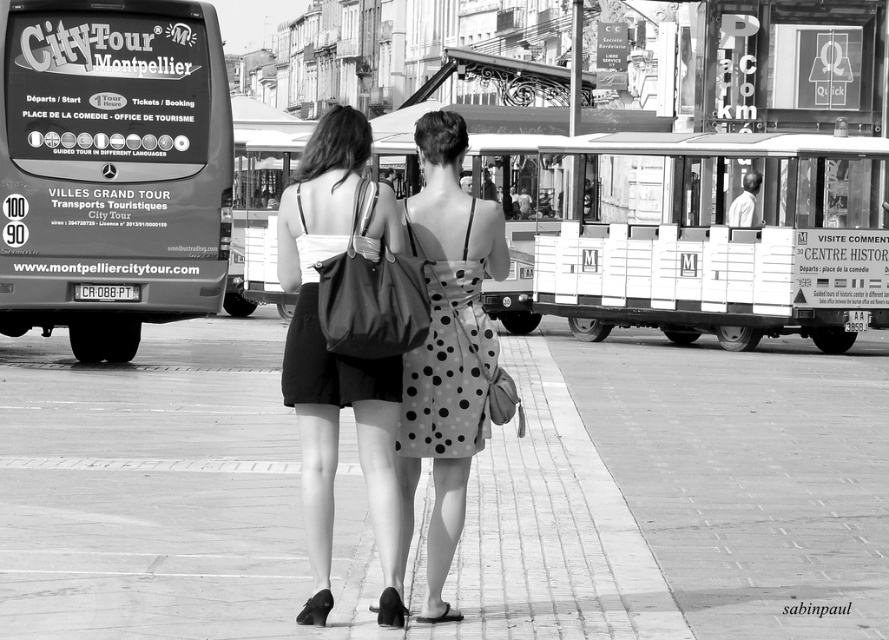
Between smooth concrete pavement at center and polka dot fabric dress at center, which one has less height?

smooth concrete pavement at center

You are a GUI agent. You are given a task and a screenshot of the screen. Output one action in this format:
    pyautogui.click(x=<x>, y=<y>)
    Task: Click on the smooth concrete pavement at center
    This screenshot has height=640, width=889.
    Given the screenshot: What is the action you would take?
    pyautogui.click(x=467, y=499)

Who is more distant from viewer, (598,596) or (463,396)?

The point (598,596) is more distant.

Where is `smooth concrete pavement at center`? The width and height of the screenshot is (889, 640). smooth concrete pavement at center is located at coordinates (467, 499).

Is matte black dress at center to the left of polka dot fabric dress at center from the viewer's perspective?

Correct, you'll find matte black dress at center to the left of polka dot fabric dress at center.

Is matte black dress at center positioned in front of polka dot fabric dress at center?

Yes.

At what (x,y) coordinates should I click in order to perform the action: click on matte black dress at center. Please return your answer as a coordinate pair (x, y). The height and width of the screenshot is (640, 889). Looking at the image, I should click on (337, 355).

Is point (521, 394) less distant than point (367, 125)?

No, (521, 394) is further to viewer.

Which of these two, smooth concrete pavement at center or matte black dress at center, stands shorter?

Standing shorter between the two is smooth concrete pavement at center.

Which is in front, point (514, 598) or point (388, 384)?

Positioned in front is point (388, 384).

The image size is (889, 640). Find the location of `smooth concrete pavement at center`. smooth concrete pavement at center is located at coordinates (467, 499).